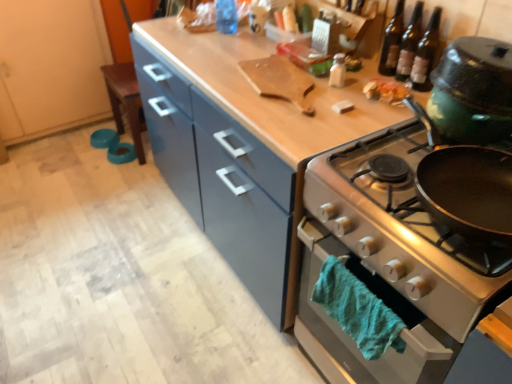
Question: From the image's perspective, is silver metallic oven at right located above translucent glass bottles at upper right, which is counted as the 1th beer bottle, starting from the right?

Choices:
 (A) yes
 (B) no

Answer: (B)

Question: From the image's perspective, is silver metallic oven at right located beneath translucent glass bottles at upper right, which is counted as the 1th beer bottle, starting from the right?

Choices:
 (A) yes
 (B) no

Answer: (A)

Question: Is silver metallic oven at right outside of translucent glass bottles at upper right, which is counted as the 1th beer bottle, starting from the right?

Choices:
 (A) no
 (B) yes

Answer: (B)

Question: Is silver metallic oven at right taller than translucent glass bottles at upper right, placed as the 2th beer bottle when sorted from left to right?

Choices:
 (A) no
 (B) yes

Answer: (A)

Question: Considering the relative positions of silver metallic oven at right and translucent glass bottles at upper right, which is counted as the 1th beer bottle, starting from the right, in the image provided, is silver metallic oven at right to the right of translucent glass bottles at upper right, which is counted as the 1th beer bottle, starting from the right, from the viewer's perspective?

Choices:
 (A) no
 (B) yes

Answer: (A)

Question: In terms of size, does shiny plastic container at upper right appear bigger or smaller than white matte salt shaker at center, which is counted as the 2th bottle, starting from the back?

Choices:
 (A) big
 (B) small

Answer: (A)

Question: Is shiny plastic container at upper right in front of or behind white matte salt shaker at center, acting as the 1th bottle starting from the front, in the image?

Choices:
 (A) front
 (B) behind

Answer: (A)

Question: Considering the positions of shiny plastic container at upper right and white matte salt shaker at center, which ranks as the second bottle in left-to-right order, in the image, is shiny plastic container at upper right wider or thinner than white matte salt shaker at center, which ranks as the second bottle in left-to-right order,?

Choices:
 (A) thin
 (B) wide

Answer: (B)

Question: In terms of height, does shiny plastic container at upper right look taller or shorter compared to white matte salt shaker at center, which is counted as the 2th bottle, starting from the back?

Choices:
 (A) short
 (B) tall

Answer: (A)

Question: Visually, is transparent plastic bottle at upper center, the first bottle viewed from the top, positioned to the left or to the right of silver metallic oven at right?

Choices:
 (A) left
 (B) right

Answer: (A)

Question: Is transparent plastic bottle at upper center, acting as the 1th bottle starting from the back, wider or thinner than silver metallic oven at right?

Choices:
 (A) wide
 (B) thin

Answer: (B)

Question: From the image's perspective, is transparent plastic bottle at upper center, acting as the first bottle starting from the left, located above or below silver metallic oven at right?

Choices:
 (A) above
 (B) below

Answer: (A)

Question: Choose the correct answer: Is transparent plastic bottle at upper center, acting as the first bottle starting from the left, inside silver metallic oven at right or outside it?

Choices:
 (A) inside
 (B) outside

Answer: (B)

Question: Considering the positions of point (425, 153) and point (402, 96), is point (425, 153) closer or farther from the camera than point (402, 96)?

Choices:
 (A) farther
 (B) closer

Answer: (B)

Question: From their relative heights in the image, would you say silver metallic oven at right is taller or shorter than shiny plastic container at upper right?

Choices:
 (A) tall
 (B) short

Answer: (A)